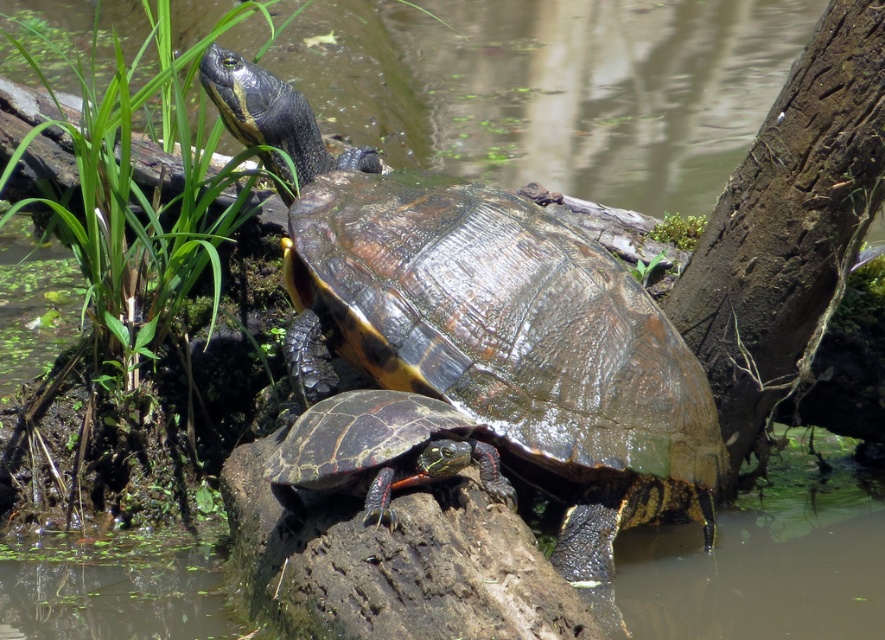
The width and height of the screenshot is (885, 640). What do you see at coordinates (486, 324) in the screenshot?
I see `shiny brown tortoise at center` at bounding box center [486, 324].

Which is behind, point (379, 381) or point (306, 413)?

The point (379, 381) is behind.

Find the location of `shiny brown tortoise at center`. shiny brown tortoise at center is located at coordinates (486, 324).